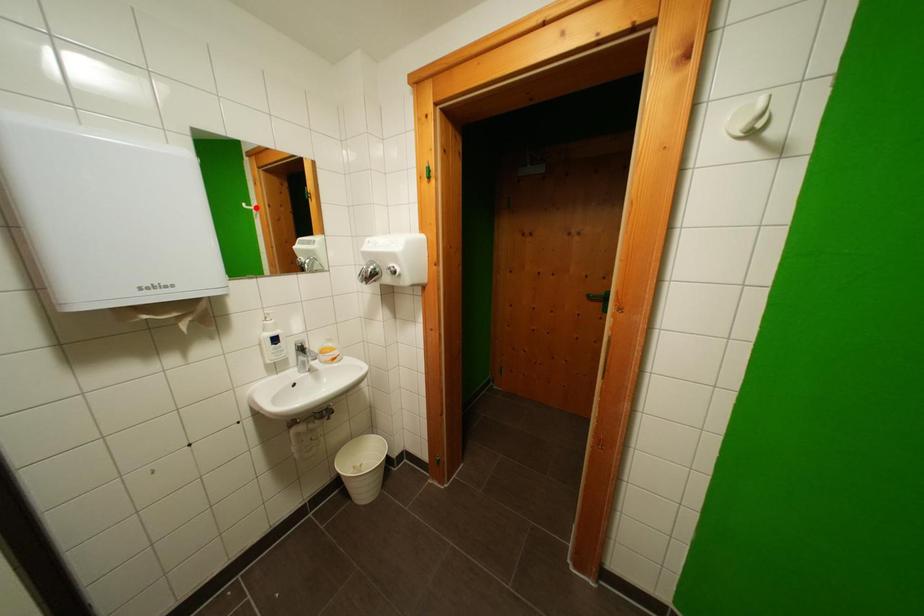
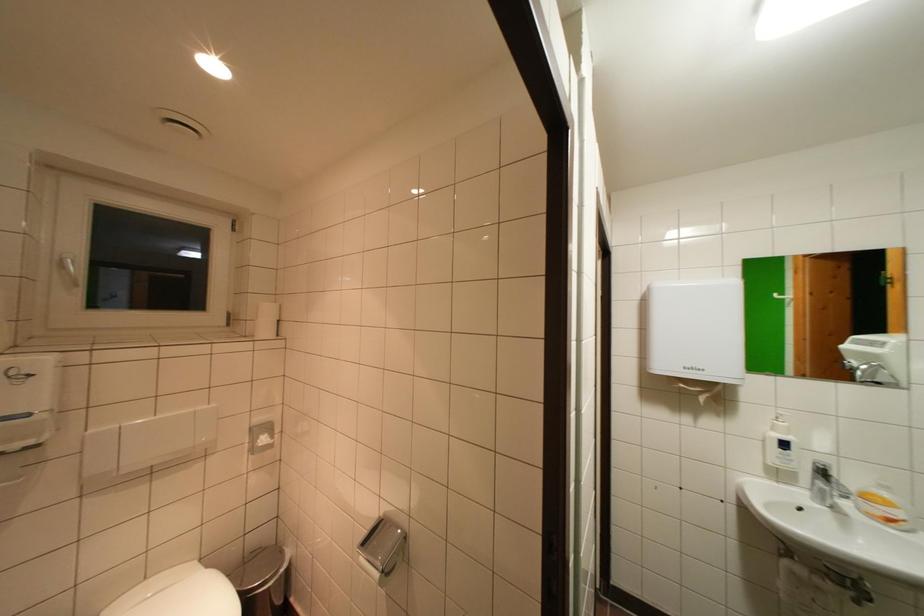
The point at the highlighted location is marked in the first image. Where is the corresponding point in the second image?

(788, 297)